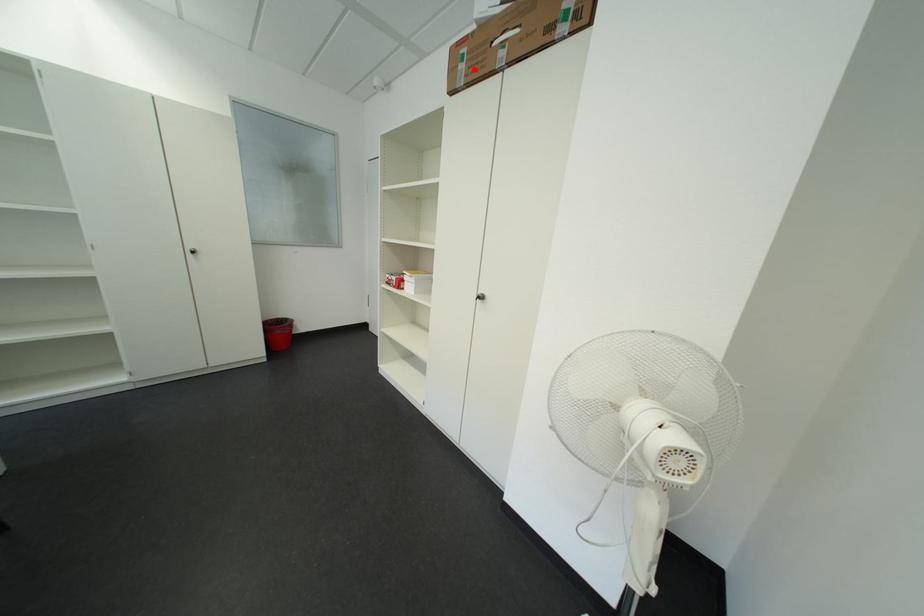
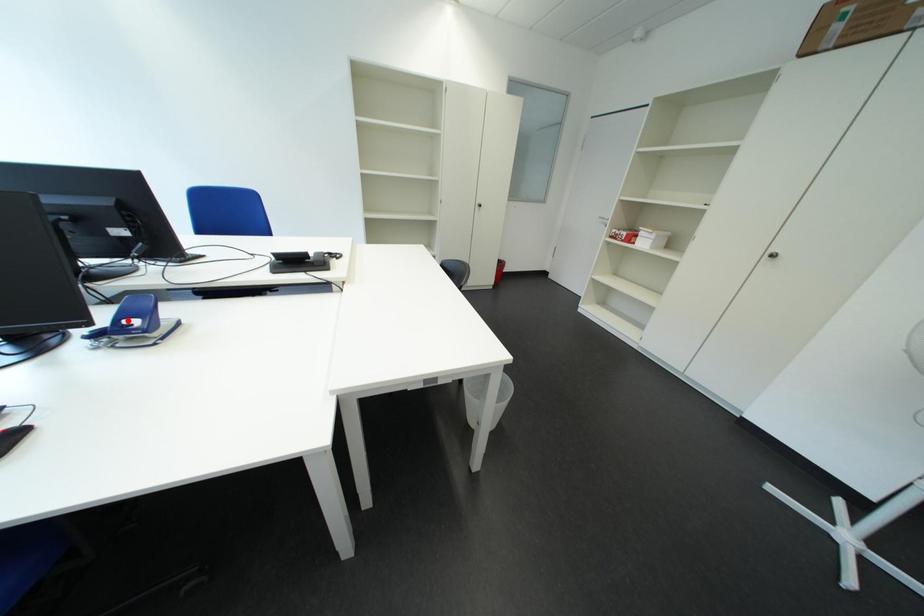
I am providing you with two images of the same scene from different viewpoints. A red point is marked on the first image and another point is marked on the second image. Do the highlighted points in image1 and image2 indicate the same real-world spot?

No